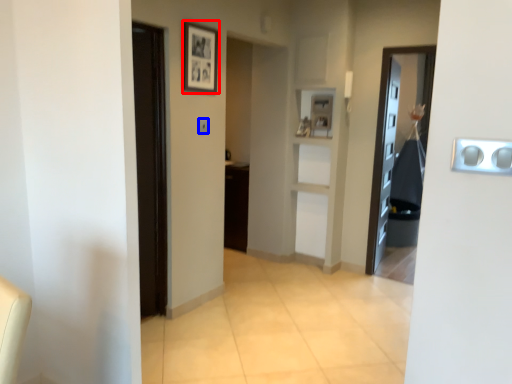
Question: Which object is closer to the camera taking this photo, picture frame (highlighted by a red box) or light switch (highlighted by a blue box)?

Choices:
 (A) picture frame
 (B) light switch

Answer: (A)